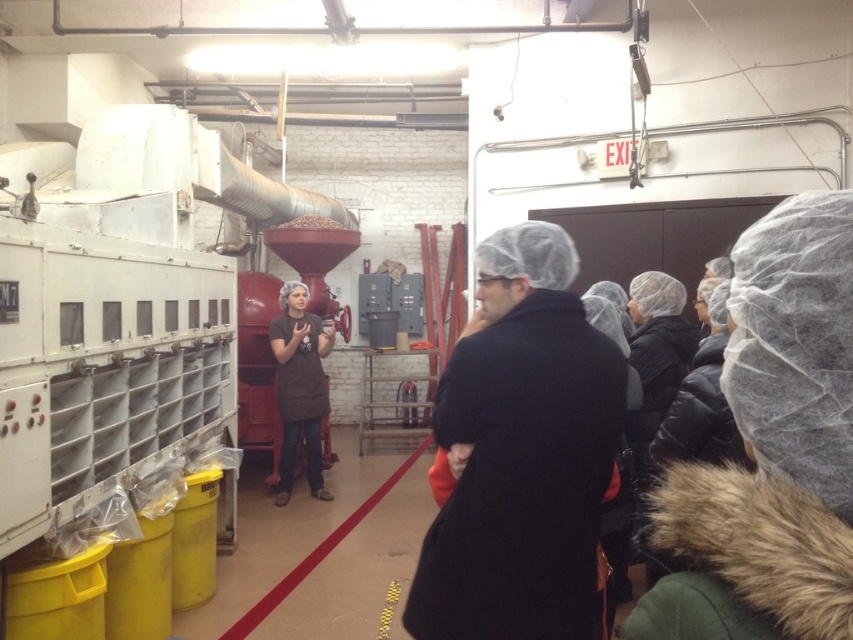
Question: Which object is positioned farthest from the brown fabric apron at center?

Choices:
 (A) black wool coat at center
 (B) red rubber line at center

Answer: (A)

Question: Can you confirm if brown fabric apron at center is bigger than red rubber line at center?

Choices:
 (A) no
 (B) yes

Answer: (B)

Question: Considering the real-world distances, which object is farthest from the black wool coat at center?

Choices:
 (A) red rubber line at center
 (B) brown fabric apron at center

Answer: (B)

Question: Is black wool coat at center thinner than red rubber line at center?

Choices:
 (A) yes
 (B) no

Answer: (B)

Question: Is brown fabric apron at center to the left of red rubber line at center from the viewer's perspective?

Choices:
 (A) no
 (B) yes

Answer: (B)

Question: Among these objects, which one is nearest to the camera?

Choices:
 (A) black wool coat at center
 (B) brown fabric apron at center
 (C) red rubber line at center

Answer: (A)